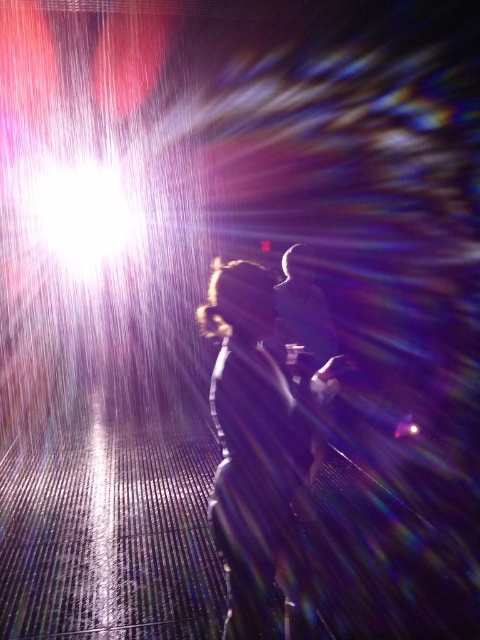
Question: Can you confirm if dark hair at center is positioned to the left of smooth black suit at center?

Choices:
 (A) yes
 (B) no

Answer: (A)

Question: Is dark hair at center positioned behind smooth black suit at center?

Choices:
 (A) yes
 (B) no

Answer: (B)

Question: Does dark hair at center appear under smooth black suit at center?

Choices:
 (A) no
 (B) yes

Answer: (B)